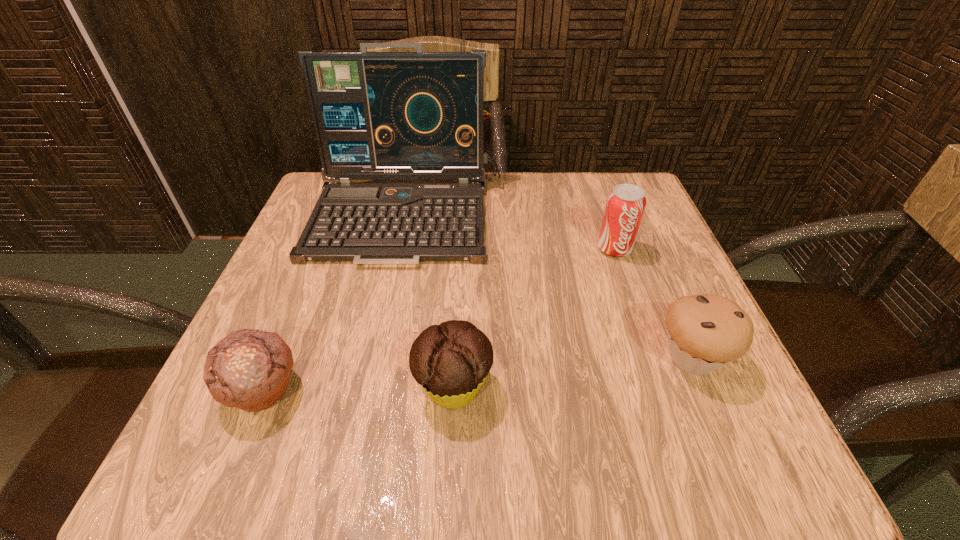
Find the location of a particular element. This screenshot has height=540, width=960. empty space that is in between the rightmost muffin and the laptop computer is located at coordinates (550, 287).

You are a GUI agent. You are given a task and a screenshot of the screen. Output one action in this format:
    pyautogui.click(x=<x>, y=<y>)
    Task: Click on the fourth closest object to the rightmost muffin
    This screenshot has height=540, width=960.
    Given the screenshot: What is the action you would take?
    pyautogui.click(x=249, y=369)

What are the coordinates of `object that is the fourth closest one to the tallest object` in the screenshot? It's located at (705, 332).

Find the location of a particular element. Image resolution: width=960 pixels, height=540 pixels. muffin that can be found as the closest to the rightmost muffin is located at coordinates (451, 361).

Point out which muffin is positioned as the nearest to the rightmost muffin. Please provide its 2D coordinates. Your answer should be formatted as a tuple, i.e. [(x, y)], where the tuple contains the x and y coordinates of a point satisfying the conditions above.

[(451, 361)]

The height and width of the screenshot is (540, 960). What are the coordinates of `free spot that satisfies the following two spatial constraints: 1. on the front-facing side of the laptop computer; 2. on the right side of the rightmost muffin` in the screenshot? It's located at (378, 358).

This screenshot has width=960, height=540. Identify the location of vacant space that satisfies the following two spatial constraints: 1. on the logo side of the rightmost muffin; 2. on the right side of the second tallest object. (653, 358).

Find the location of a particular element. This screenshot has width=960, height=540. vacant region that satisfies the following two spatial constraints: 1. on the front-facing side of the rightmost muffin; 2. on the left side of the tallest object is located at coordinates (378, 358).

This screenshot has width=960, height=540. Find the location of `vacant position in the image that satisfies the following two spatial constraints: 1. on the front-facing side of the rightmost muffin; 2. on the left side of the tallest object`. vacant position in the image that satisfies the following two spatial constraints: 1. on the front-facing side of the rightmost muffin; 2. on the left side of the tallest object is located at coordinates (378, 358).